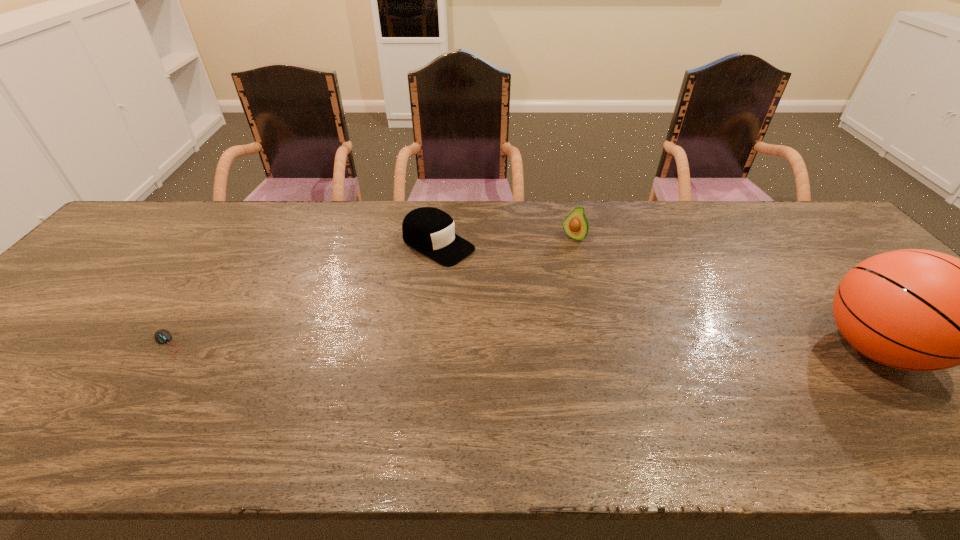
The height and width of the screenshot is (540, 960). I want to click on free spot located on the front-facing side of the cap, so click(498, 277).

Where is `free space located 0.080m on the front-facing side of the cap`? Image resolution: width=960 pixels, height=540 pixels. free space located 0.080m on the front-facing side of the cap is located at coordinates (487, 271).

Where is `free spot located 0.250m on the front-facing side of the cap`? The image size is (960, 540). free spot located 0.250m on the front-facing side of the cap is located at coordinates (537, 299).

At what (x,y) coordinates should I click in order to perform the action: click on avocado that is at the far edge. Please return your answer as a coordinate pair (x, y). Looking at the image, I should click on (575, 225).

Locate an element on the screen. The image size is (960, 540). cap present at the far edge is located at coordinates (431, 231).

Image resolution: width=960 pixels, height=540 pixels. In order to click on free region at the far edge of the desktop in this screenshot , I will do `click(399, 227)`.

Image resolution: width=960 pixels, height=540 pixels. In the image, there is a desktop. Find the location of `blank space at the near edge`. blank space at the near edge is located at coordinates (736, 395).

This screenshot has height=540, width=960. In order to click on vacant space at the left edge in this screenshot , I will do `click(46, 307)`.

Find the location of a particular element. vacant region at the right edge of the desktop is located at coordinates (825, 258).

What are the coordinates of `vacant space at the far right corner` in the screenshot? It's located at (786, 224).